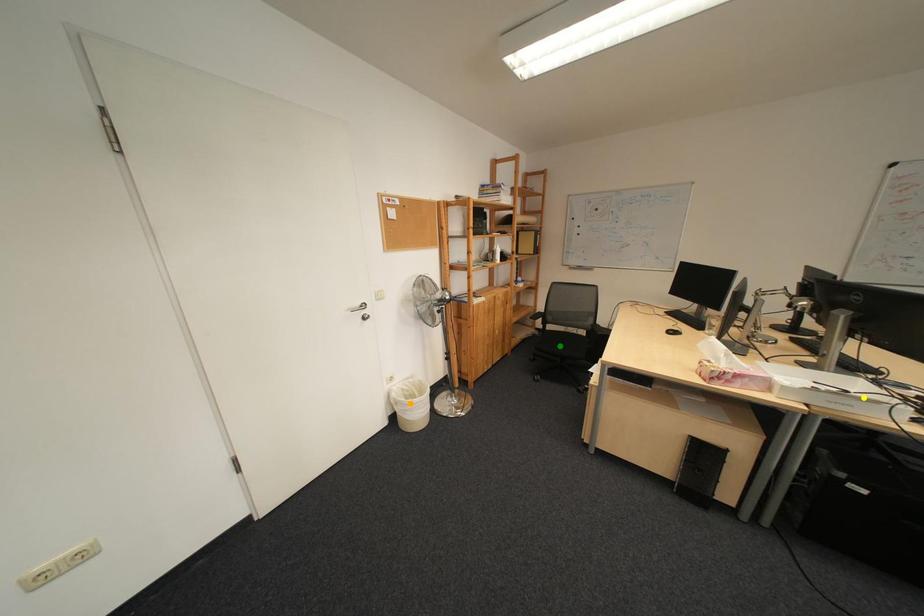
Order these from nearest to farthest:
orange point | yellow point | green point

yellow point
orange point
green point